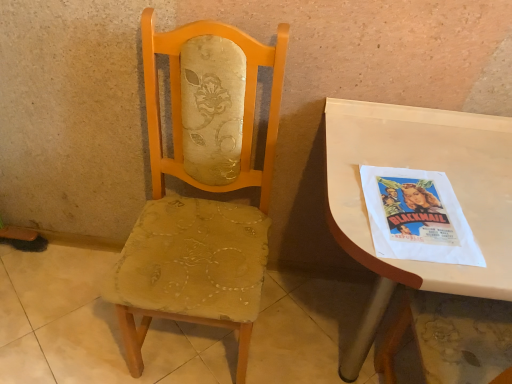
Locate an element on the screen. free space above worn fabric chair at center (from a real-world perspective) is located at coordinates (144, 348).